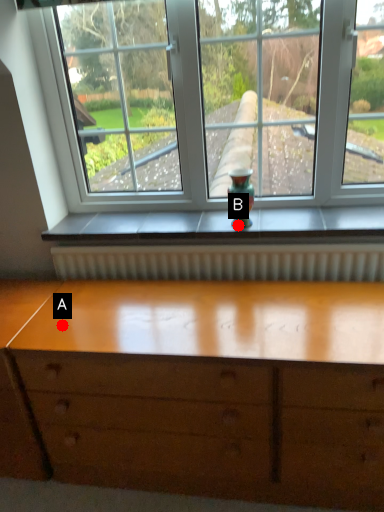
Question: Two points are circled on the image, labeled by A and B beside each circle. Which point appears farthest from the camera in this image?

Choices:
 (A) A is further
 (B) B is further

Answer: (B)